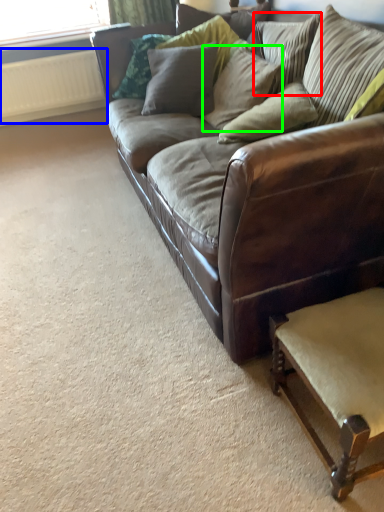
Question: Considering the real-world distances, which object is farthest from pillow (highlighted by a red box)? radiator (highlighted by a blue box) or pillow (highlighted by a green box)?

Choices:
 (A) radiator
 (B) pillow

Answer: (A)